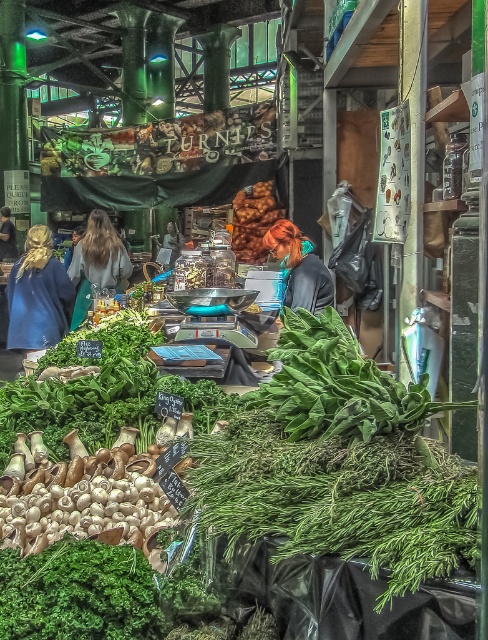
Is blue fabric at left taller than shiny blue hair at center?

Correct, blue fabric at left is much taller as shiny blue hair at center.

Is blue fabric at left bigger than shiny blue hair at center?

Indeed, blue fabric at left has a larger size compared to shiny blue hair at center.

Does point (37, 266) lie in front of point (312, 273)?

That is False.

Image resolution: width=488 pixels, height=640 pixels. Find the location of `blue fabric at left`. blue fabric at left is located at coordinates (38, 294).

Is point (96, 593) closer to viewer compared to point (32, 269)?

Yes, point (96, 593) is in front of point (32, 269).

Consider the image. Which is more to the left, green leafy at lower left or blue fabric at left?

blue fabric at left is more to the left.

Who is more forward, (104, 547) or (11, 337)?

Point (104, 547)

This screenshot has width=488, height=640. Find the location of `green leafy at lower left`. green leafy at lower left is located at coordinates (78, 593).

Consider the image. Who is positioned more to the left, light brown hair at center or shiny blue hair at center?

light brown hair at center

Between light brown hair at center and shiny blue hair at center, which one has more height?

light brown hair at center

Does point (105, 268) come closer to viewer compared to point (309, 256)?

No.

This screenshot has width=488, height=640. Identify the location of light brown hair at center. (97, 260).